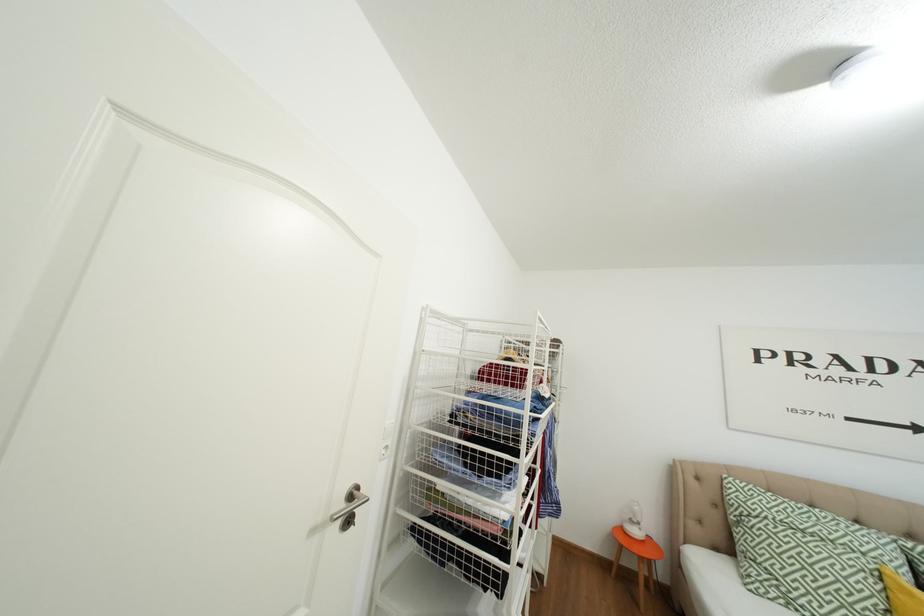
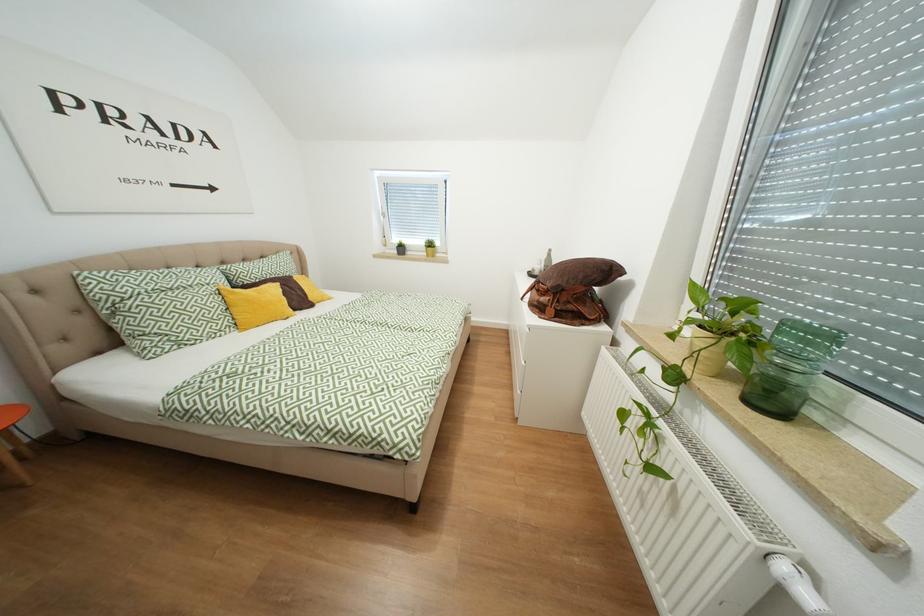
How did the camera likely rotate?

The rotation direction of the camera is right-down.